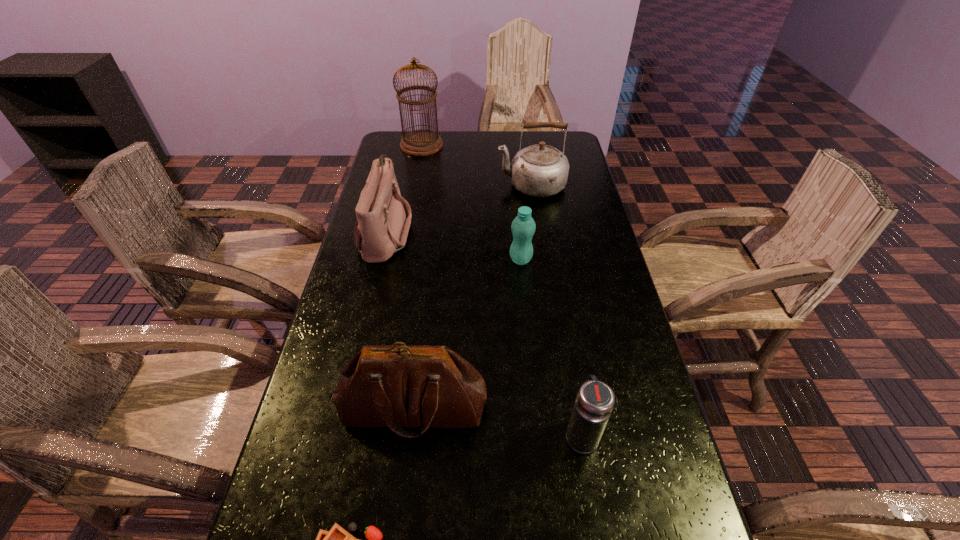
This screenshot has width=960, height=540. Find the location of `birdcage`. birdcage is located at coordinates (422, 142).

At what (x,y) coordinates should I click in order to perform the action: click on the tallest object. Please return your answer as a coordinate pair (x, y). Looking at the image, I should click on (422, 142).

Image resolution: width=960 pixels, height=540 pixels. What are the coordinates of `kettle` in the screenshot? It's located at [x=541, y=170].

This screenshot has height=540, width=960. In order to click on the taller shoulder bag in this screenshot , I will do `click(394, 386)`.

Locate an element on the screen. the shorter shoulder bag is located at coordinates (381, 229).

The width and height of the screenshot is (960, 540). Find the location of `bottle`. bottle is located at coordinates coord(523,227).

What are the coordinates of `thermos bottle` in the screenshot? It's located at (595, 400).

The image size is (960, 540). I want to click on free space located 0.270m on the front-facing side of the farthest object, so click(511, 145).

You are a GUI agent. You are given a task and a screenshot of the screen. Output one action in this format:
    pyautogui.click(x=<x>, y=<y>)
    Task: Click on the free space located 0.130m at the spout of the kettle
    This screenshot has width=960, height=540.
    Given the screenshot: What is the action you would take?
    pyautogui.click(x=461, y=185)

This screenshot has width=960, height=540. I want to click on vacant space situated 0.170m at the spout of the kettle, so click(449, 185).